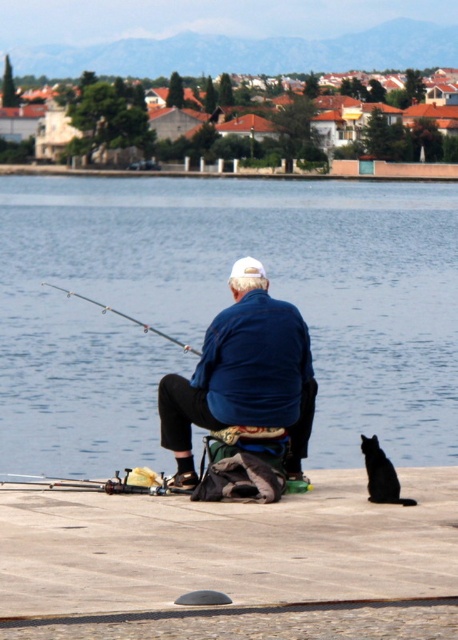
Question: Which of the following is the farthest from the observer?

Choices:
 (A) blue water at center
 (B) smooth concrete dock at lower center
 (C) silver metallic fishing pole at left
 (D) brushed metal fishing pole at lower left

Answer: (A)

Question: Which is farther from the blue cotton jacket at center?

Choices:
 (A) silver metallic fishing pole at left
 (B) blue water at center

Answer: (B)

Question: Is blue water at center to the left of silver metallic fishing pole at left from the viewer's perspective?

Choices:
 (A) no
 (B) yes

Answer: (A)

Question: Among these objects, which one is nearest to the camera?

Choices:
 (A) black fur cat at lower right
 (B) blue water at center
 (C) silver metallic fishing pole at left
 (D) smooth concrete dock at lower center

Answer: (D)

Question: In this image, where is smooth concrete dock at lower center located relative to silver metallic fishing pole at left?

Choices:
 (A) below
 (B) above

Answer: (A)

Question: Does smooth concrete dock at lower center have a larger size compared to black fur cat at lower right?

Choices:
 (A) yes
 (B) no

Answer: (A)